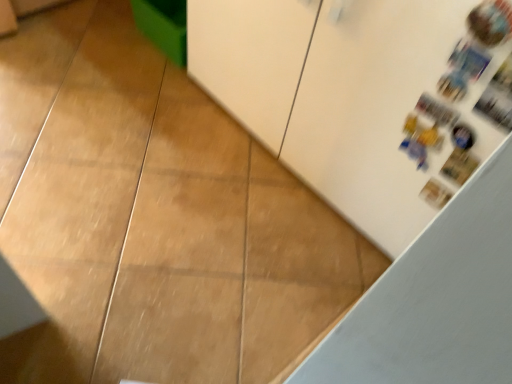
Describe the element at coordinates (362, 95) in the screenshot. This screenshot has width=512, height=384. I see `white matte cabinet at upper right` at that location.

The width and height of the screenshot is (512, 384). In order to click on white matte cabinet at upper right in this screenshot , I will do `click(362, 95)`.

Locate an element on the screen. Image resolution: width=512 pixels, height=384 pixels. white matte cabinet at upper right is located at coordinates coord(362,95).